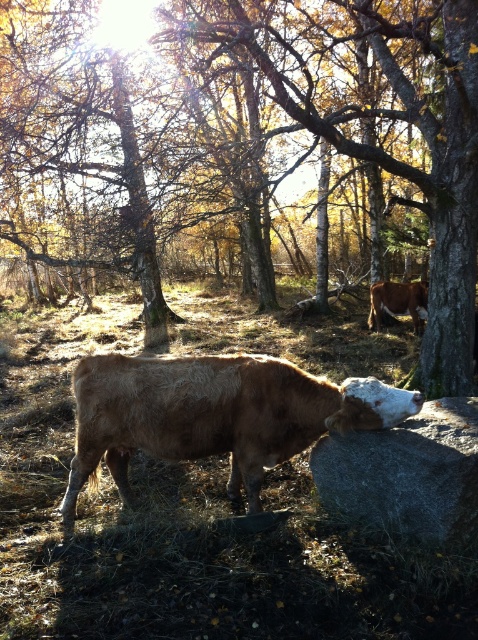
Describe the element at coordinates (186, 529) in the screenshot. I see `brown grass at center` at that location.

Between brown grass at center and brown fuzzy bull at center, which one has less height?

With less height is brown fuzzy bull at center.

Which is behind, point (19, 486) or point (284, 408)?

Point (19, 486)

Image resolution: width=478 pixels, height=640 pixels. Find the location of `brown grass at center`. brown grass at center is located at coordinates (186, 529).

Is brown fuzzy bull at center closer to the viewer compared to brown furry bull at center?

Yes, brown fuzzy bull at center is in front of brown furry bull at center.

Which is in front, point (155, 440) or point (369, 288)?

Positioned in front is point (155, 440).

Does point (330, 390) lie behind point (391, 310)?

No, it is not.

You are a GUI agent. You are given a task and a screenshot of the screen. Output one action in this format:
    pyautogui.click(x=<x>, y=<y>)
    Task: Click on the brown fuzzy bull at center
    Image resolution: width=478 pixels, height=640 pixels.
    Given the screenshot: What is the action you would take?
    pyautogui.click(x=215, y=413)

Who is taller, brown bark tree at center or brown furry bull at center?

brown bark tree at center is taller.

Between brown bark tree at center and brown furry bull at center, which one appears on the left side from the viewer's perspective?

From the viewer's perspective, brown bark tree at center appears more on the left side.

Image resolution: width=478 pixels, height=640 pixels. Find the location of `brown bark tree at center`. brown bark tree at center is located at coordinates (242, 138).

You are a GUI agent. You are given a task and a screenshot of the screen. Output one action in this format:
    pyautogui.click(x=<x>, y=<y>)
    Task: Click on the brown bark tree at center
    
    Given the screenshot: What is the action you would take?
    pyautogui.click(x=242, y=138)